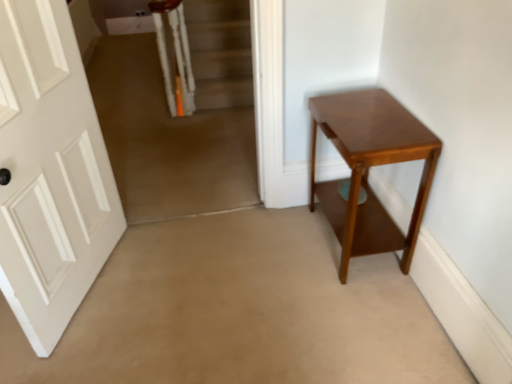
Question: Is shiny brown table at right in front of white matte door at left?

Choices:
 (A) no
 (B) yes

Answer: (A)

Question: Can you confirm if shiny brown table at right is positioned to the right of white matte door at left?

Choices:
 (A) yes
 (B) no

Answer: (A)

Question: Is shiny brown table at right taller than white matte door at left?

Choices:
 (A) yes
 (B) no

Answer: (B)

Question: From the image's perspective, is shiny brown table at right under white matte door at left?

Choices:
 (A) no
 (B) yes

Answer: (B)

Question: Is shiny brown table at right bigger than white matte door at left?

Choices:
 (A) yes
 (B) no

Answer: (B)

Question: Would you say shiny brown table at right is to the left or to the right of white matte door at left in the picture?

Choices:
 (A) right
 (B) left

Answer: (A)

Question: Is shiny brown table at right taller or shorter than white matte door at left?

Choices:
 (A) tall
 (B) short

Answer: (B)

Question: Is shiny brown table at right wider or thinner than white matte door at left?

Choices:
 (A) wide
 (B) thin

Answer: (A)

Question: Is point (375, 99) closer or farther from the camera than point (15, 77)?

Choices:
 (A) farther
 (B) closer

Answer: (A)

Question: Based on their sizes in the image, would you say carpeted stairs at upper left is bigger or smaller than shiny brown table at right?

Choices:
 (A) small
 (B) big

Answer: (B)

Question: From a real-world perspective, is carpeted stairs at upper left physically located above or below shiny brown table at right?

Choices:
 (A) above
 (B) below

Answer: (A)

Question: In terms of width, does carpeted stairs at upper left look wider or thinner when compared to shiny brown table at right?

Choices:
 (A) wide
 (B) thin

Answer: (B)

Question: Relative to shiny brown table at right, is carpeted stairs at upper left in front or behind?

Choices:
 (A) front
 (B) behind

Answer: (B)

Question: Considering the positions of carpeted stairs at upper left and white matte door at left in the image, is carpeted stairs at upper left taller or shorter than white matte door at left?

Choices:
 (A) tall
 (B) short

Answer: (B)

Question: From a real-world perspective, is carpeted stairs at upper left above or below white matte door at left?

Choices:
 (A) below
 (B) above

Answer: (A)